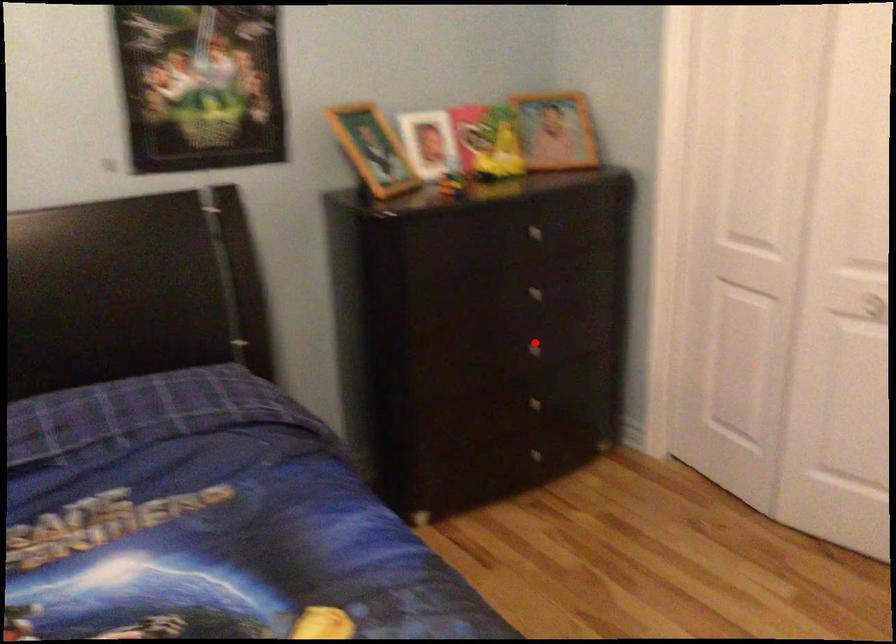
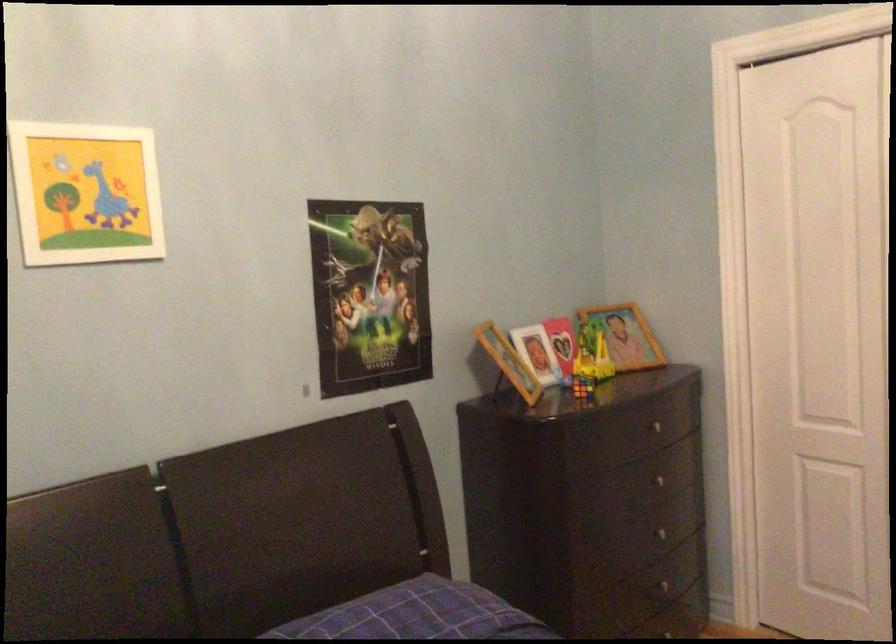
In the second image, find the point that corresponds to the highlighted location in the first image.

(667, 532)